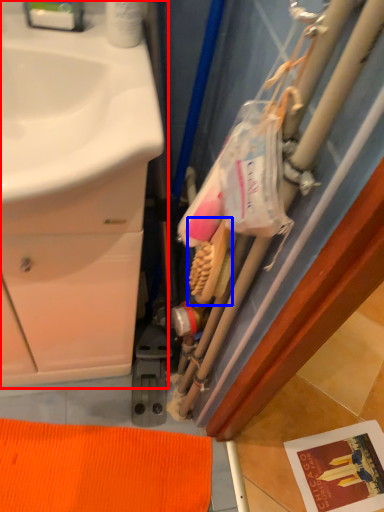
Question: Among these objects, which one is nearest to the camera, bathroom cabinet (highlighted by a red box) or brush (highlighted by a blue box)?

Choices:
 (A) bathroom cabinet
 (B) brush

Answer: (A)